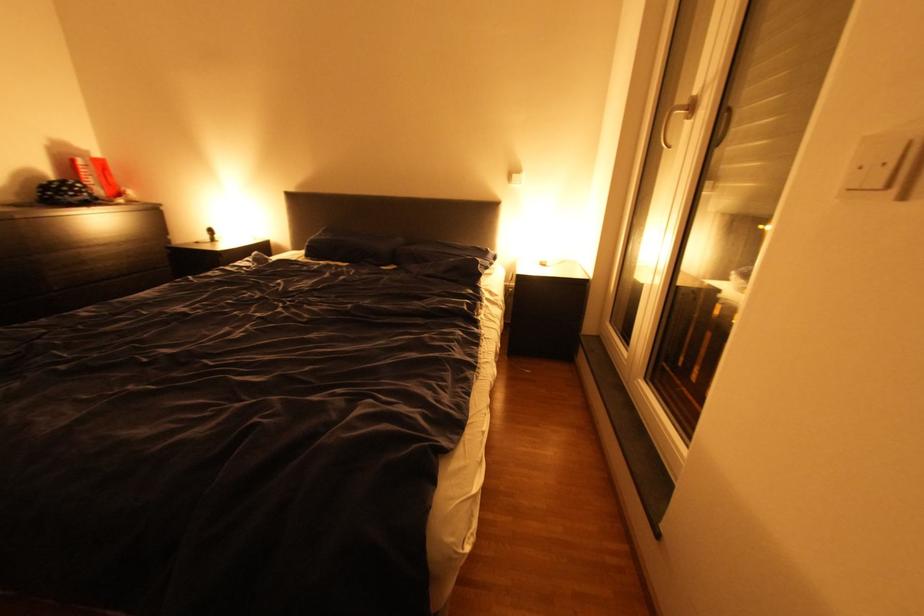
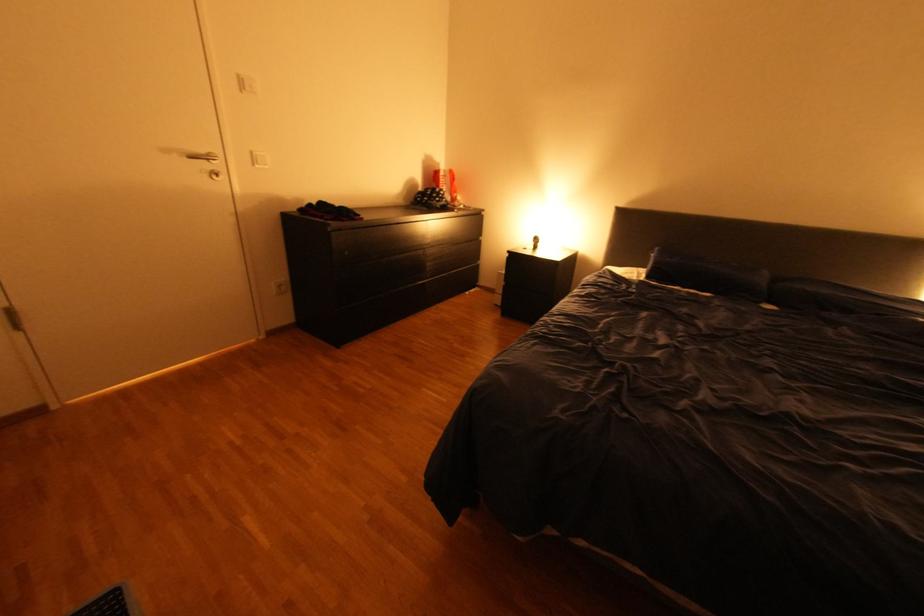
Find the pixel in the second image that matches [310,257] in the first image.

(648, 277)